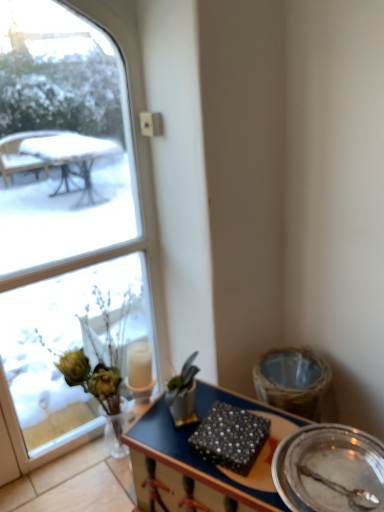
Find the location of a particular element. Image resolution: width=384 pixels, height=512 pixels. free location to the left of pearl-patterned fabric at center is located at coordinates (171, 441).